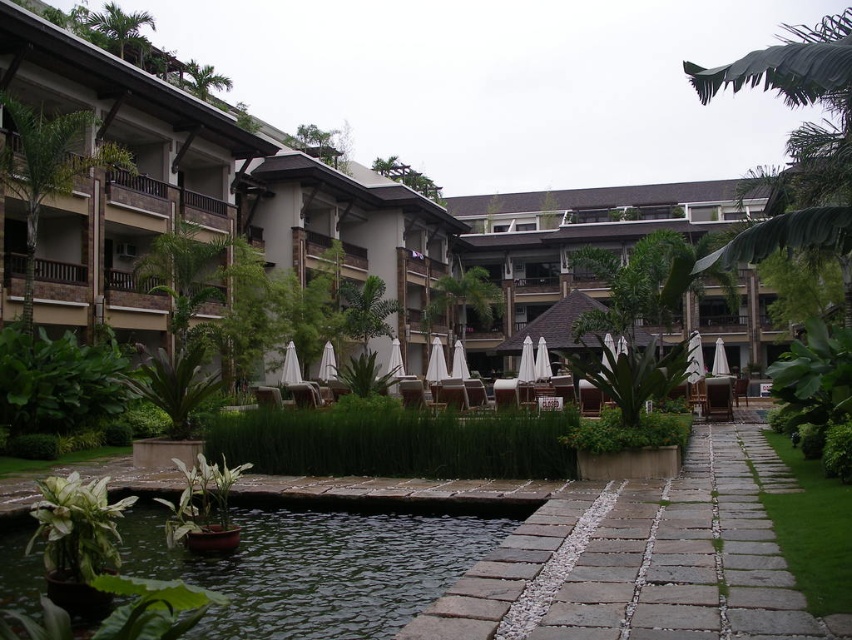
Question: Among these points, which one is farthest from the camera?

Choices:
 (A) (318, 369)
 (B) (751, 516)

Answer: (A)

Question: Observing the image, what is the correct spatial positioning of green concrete pool at lower center in reference to white fabric umbrella at center?

Choices:
 (A) left
 (B) right

Answer: (B)

Question: Which object is farther from the camera taking this photo?

Choices:
 (A) green concrete pool at lower center
 (B) brown textured resort at center
 (C) gray stone path at center

Answer: (B)

Question: Estimate the real-world distances between objects in this image. Which object is farther from the green concrete pool at lower center?

Choices:
 (A) white fabric umbrella at center
 (B) gray stone path at center
 (C) brown textured resort at center

Answer: (C)

Question: Does brown textured resort at center have a lesser width compared to white fabric umbrella at center?

Choices:
 (A) yes
 (B) no

Answer: (B)

Question: Considering the relative positions of brown textured resort at center and white fabric umbrella at center in the image provided, where is brown textured resort at center located with respect to white fabric umbrella at center?

Choices:
 (A) above
 (B) below

Answer: (A)